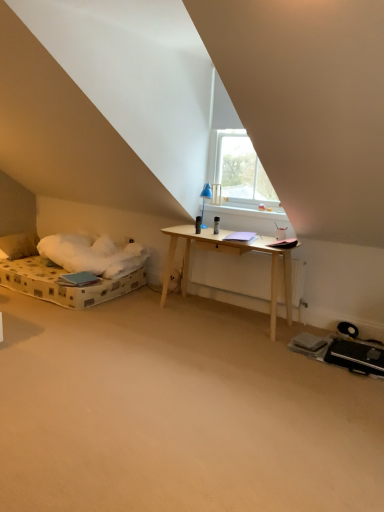
Question: From the image's perspective, would you say soft white pillow at left is positioned over transparent glass window at upper center?

Choices:
 (A) yes
 (B) no

Answer: (B)

Question: Does soft white pillow at left turn towards transparent glass window at upper center?

Choices:
 (A) no
 (B) yes

Answer: (A)

Question: Considering the relative sizes of soft white pillow at left and transparent glass window at upper center in the image provided, is soft white pillow at left shorter than transparent glass window at upper center?

Choices:
 (A) no
 (B) yes

Answer: (B)

Question: Is soft white pillow at left facing away from transparent glass window at upper center?

Choices:
 (A) no
 (B) yes

Answer: (A)

Question: Does soft white pillow at left have a greater height compared to transparent glass window at upper center?

Choices:
 (A) no
 (B) yes

Answer: (A)

Question: Considering the positions of point (241, 132) and point (188, 500), is point (241, 132) closer or farther from the camera than point (188, 500)?

Choices:
 (A) farther
 (B) closer

Answer: (A)

Question: Considering the positions of transparent glass window at upper center and beige carpet at center in the image, is transparent glass window at upper center taller or shorter than beige carpet at center?

Choices:
 (A) tall
 (B) short

Answer: (A)

Question: Choose the correct answer: Is transparent glass window at upper center inside beige carpet at center or outside it?

Choices:
 (A) inside
 (B) outside

Answer: (B)

Question: From a real-world perspective, is transparent glass window at upper center physically located above or below beige carpet at center?

Choices:
 (A) below
 (B) above

Answer: (B)

Question: From a real-world perspective, relative to transparent glass window at upper center, is soft white pillow at left vertically above or below?

Choices:
 (A) below
 (B) above

Answer: (A)

Question: Looking at the image, does soft white pillow at left seem bigger or smaller compared to transparent glass window at upper center?

Choices:
 (A) small
 (B) big

Answer: (B)

Question: Considering the positions of point (31, 234) and point (220, 123), is point (31, 234) closer or farther from the camera than point (220, 123)?

Choices:
 (A) closer
 (B) farther

Answer: (B)

Question: In the image, is soft white pillow at left positioned in front of or behind transparent glass window at upper center?

Choices:
 (A) behind
 (B) front

Answer: (A)

Question: Is beige carpet at center in front of or behind soft white pillow at left in the image?

Choices:
 (A) front
 (B) behind

Answer: (A)

Question: From a real-world perspective, is beige carpet at center positioned above or below soft white pillow at left?

Choices:
 (A) below
 (B) above

Answer: (A)